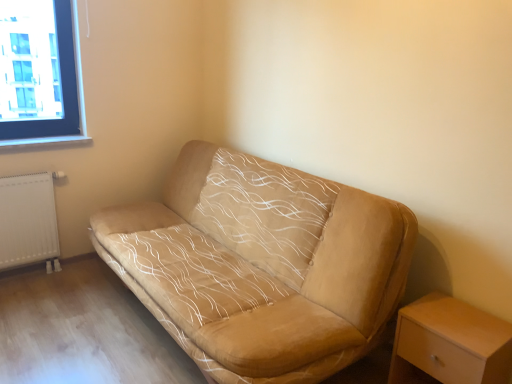
This screenshot has width=512, height=384. I want to click on vacant space situated above light wood/wooden nightstand at lower right (from a real-world perspective), so pos(459,321).